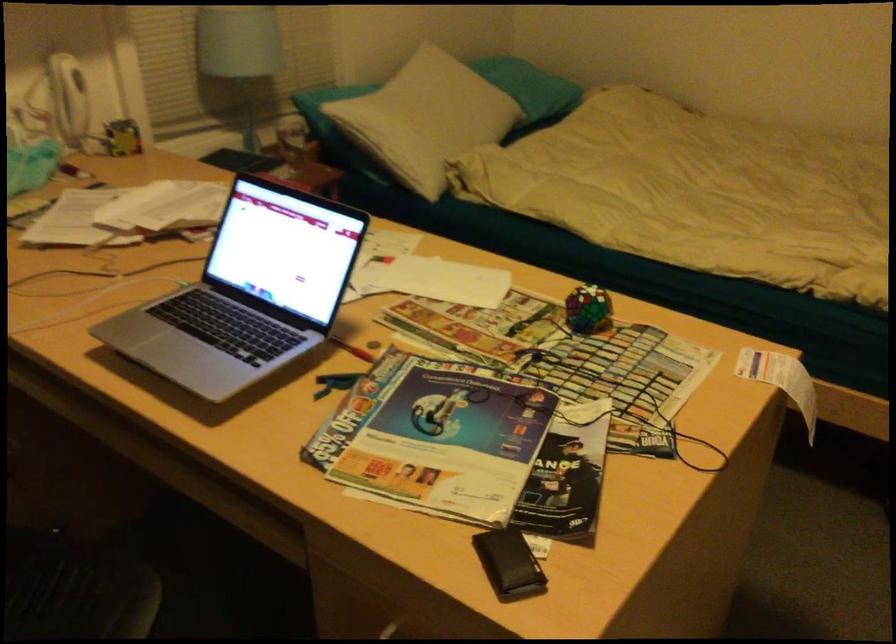
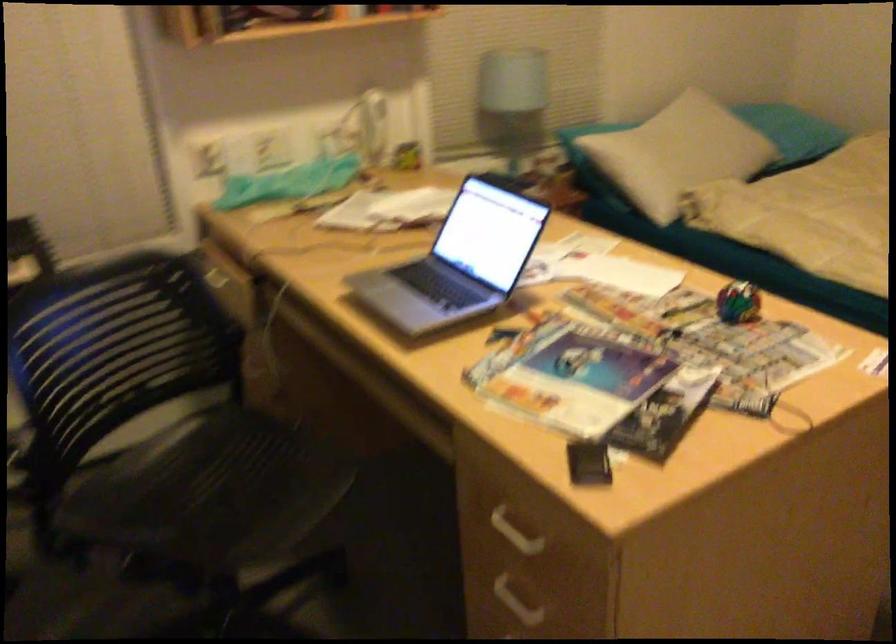
Question: The first image is from the beginning of the video and the second image is from the end. How did the camera likely rotate when shooting the video?

Choices:
 (A) Left
 (B) Right
 (C) Up
 (D) Down

Answer: (A)